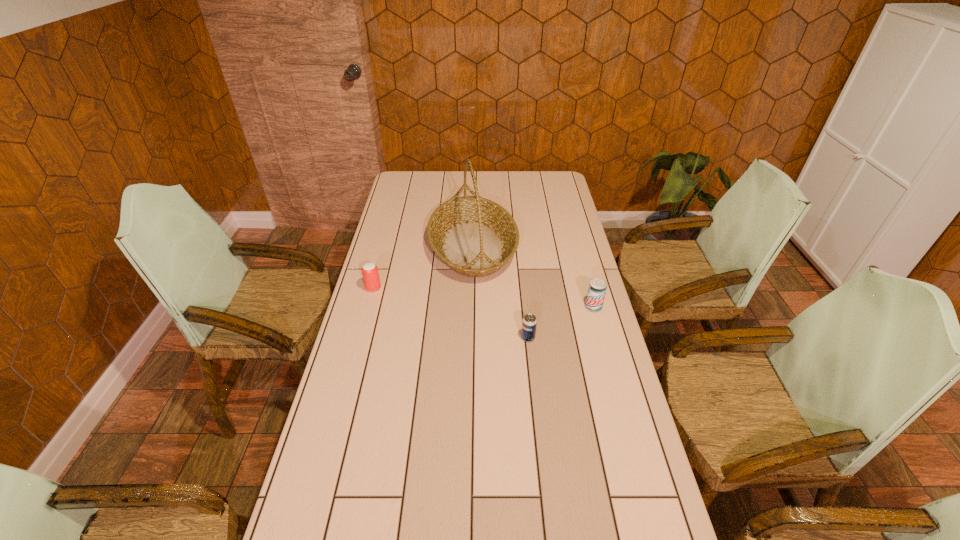
This screenshot has height=540, width=960. What are the coordinates of `the tallest object` in the screenshot? It's located at (474, 236).

Identify the location of the second nearest beer can. The image size is (960, 540). (597, 289).

Image resolution: width=960 pixels, height=540 pixels. Identify the location of the rightmost beer can. (597, 289).

This screenshot has height=540, width=960. Find the location of `the leftmost beer can`. the leftmost beer can is located at coordinates (370, 273).

Where is `the farthest beer can`? the farthest beer can is located at coordinates (370, 273).

The height and width of the screenshot is (540, 960). What are the coordinates of `the shortest object` in the screenshot? It's located at (529, 323).

Locate an element on the screen. the nearest beer can is located at coordinates (529, 323).

Find the location of a particular element. The width and height of the screenshot is (960, 540). free space located 0.340m on the front of the basket is located at coordinates (470, 361).

Find the location of a particular element. This screenshot has height=540, width=960. free space located 0.350m on the back of the rightmost object is located at coordinates (576, 244).

At what (x,y) coordinates should I click in order to perform the action: click on free spot located 0.190m on the front of the leftmost object. Please return your answer as a coordinate pair (x, y). The height and width of the screenshot is (540, 960). Looking at the image, I should click on 362,332.